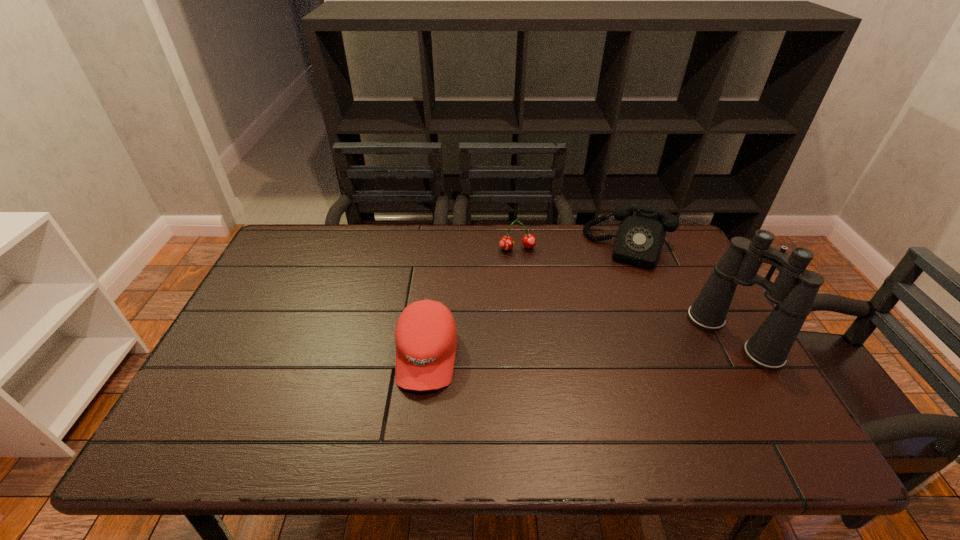
At what (x,y) coordinates should I click in order to perform the action: click on free space located with stems pointing upwards on the second object from left to right. Please return your answer as a coordinate pair (x, y). The image size is (960, 540). Looking at the image, I should click on (545, 340).

Find the location of `telephone at the far edge`. telephone at the far edge is located at coordinates (640, 237).

I want to click on cherry that is at the far edge, so click(x=506, y=243).

Identify the location of object that is at the near edge. (426, 334).

Identify the location of binoculars present at the right edge. The image size is (960, 540). (793, 292).

Find the location of a particular element. telephone that is at the right edge is located at coordinates (640, 237).

The height and width of the screenshot is (540, 960). What are the coordinates of `object present at the far right corner` in the screenshot? It's located at (640, 237).

In the image, there is a desktop. Where is `vacant space at the far edge`? The image size is (960, 540). vacant space at the far edge is located at coordinates (512, 252).

Locate an element on the screen. free point at the near edge is located at coordinates (440, 404).

Identify the location of vacant space at the left edge of the desktop. (289, 291).